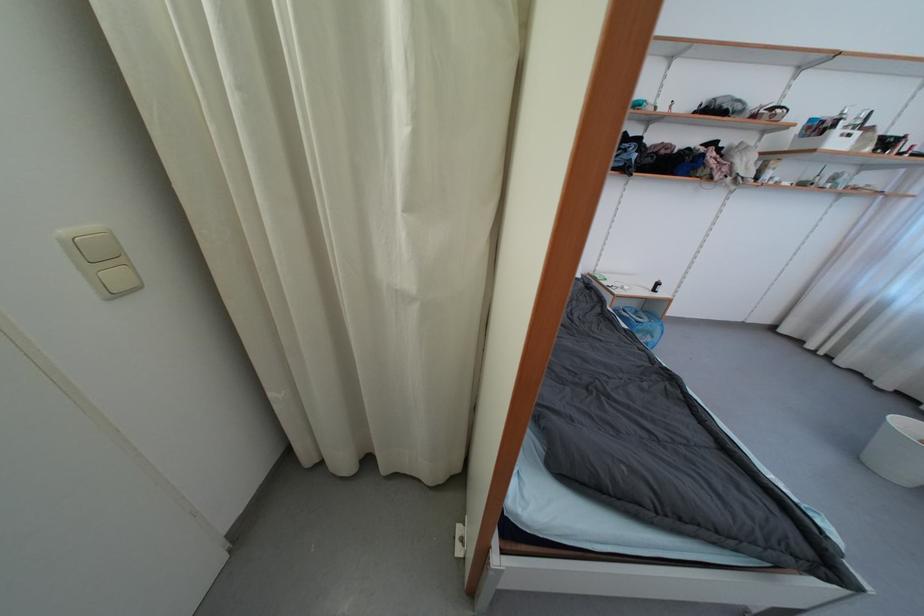
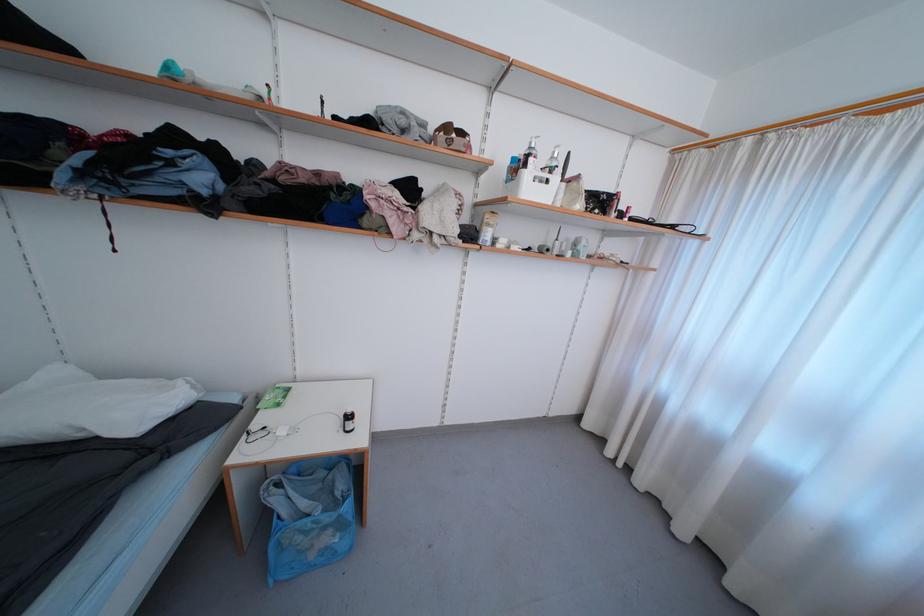
The point at (628, 314) is marked in the first image. Where is the corresponding point in the second image?

(284, 488)